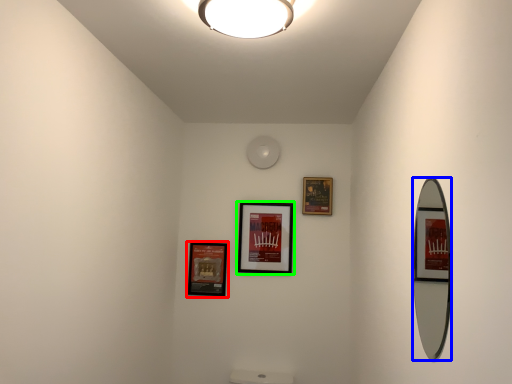
Question: Estimate the real-world distances between objects in this image. Which object is closer to picture frame (highlighted by a red box), mirror (highlighted by a blue box) or picture frame (highlighted by a green box)?

Choices:
 (A) mirror
 (B) picture frame

Answer: (B)